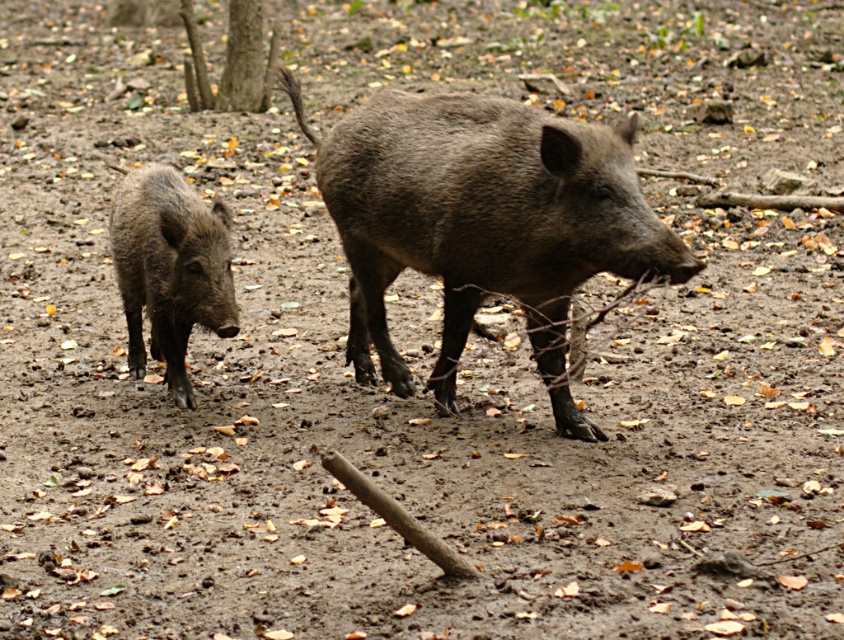
Can you confirm if dark brown textured pig at center is positioned above dark brown muddy pig at left?

Yes.

Does point (339, 212) come closer to viewer compared to point (164, 205)?

Yes, it is in front of point (164, 205).

Find the location of a particular element. The image size is (844, 640). dark brown textured pig at center is located at coordinates (482, 221).